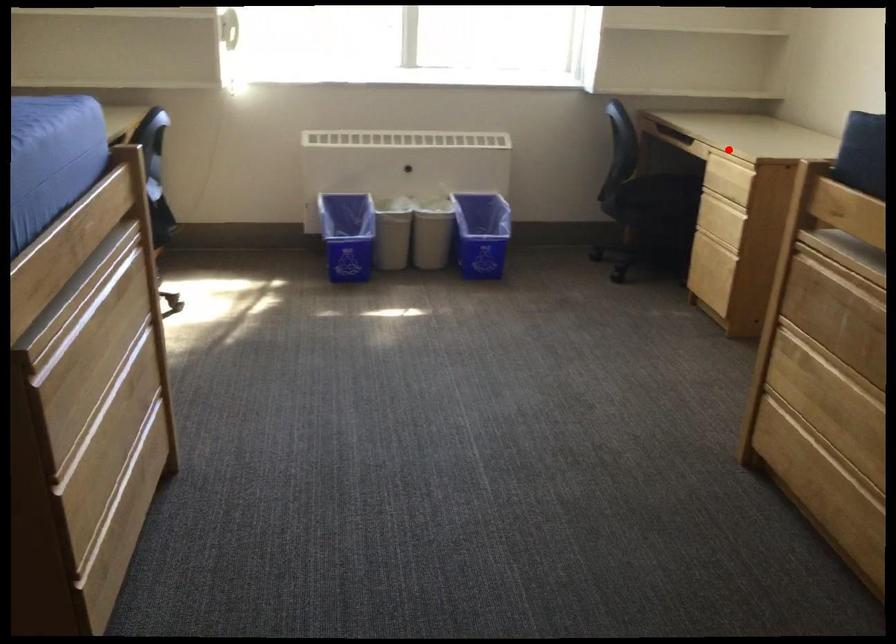
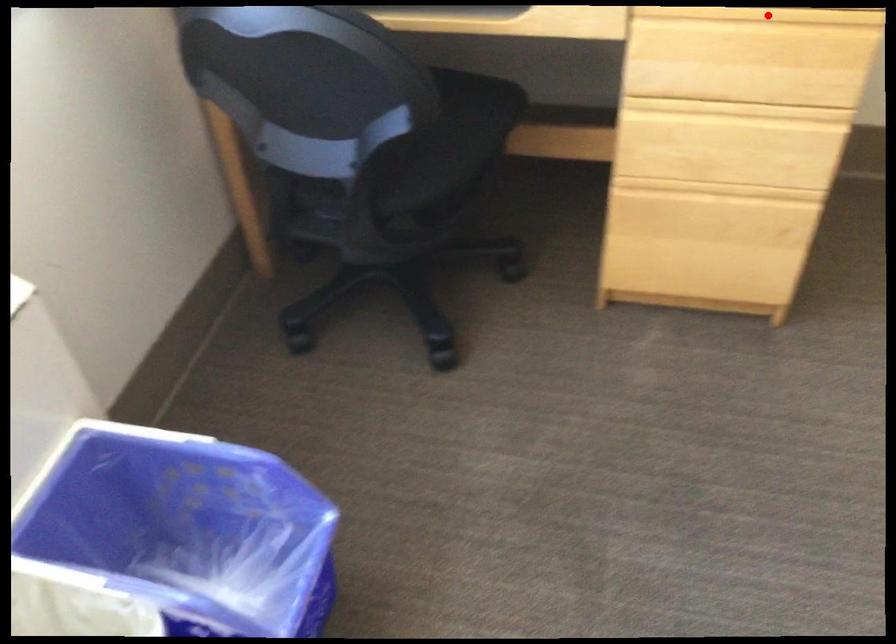
I am providing you with two images of the same scene from different viewpoints. A red point is marked on the first image and another point is marked on the second image. Is the marked point in image1 the same physical position as the marked point in image2?

Yes